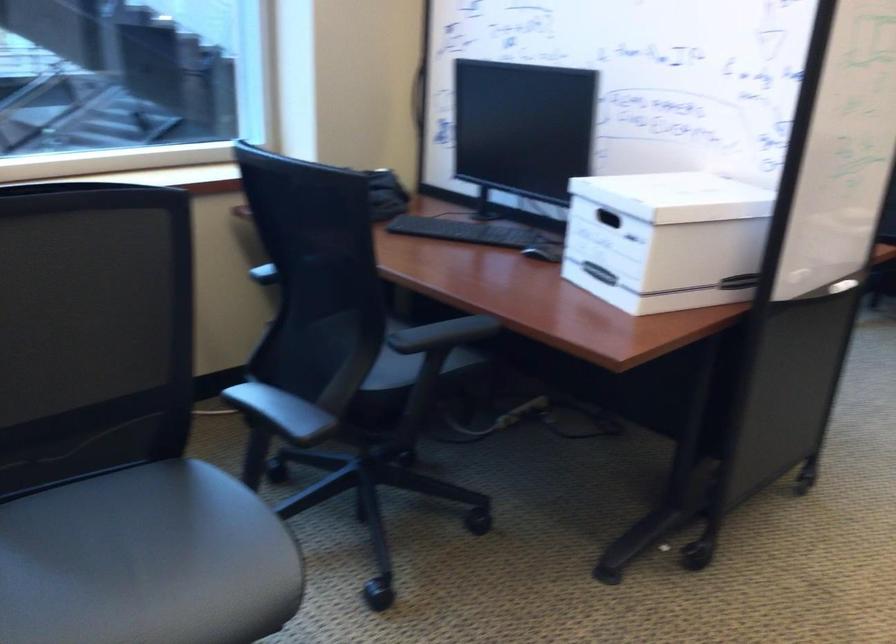
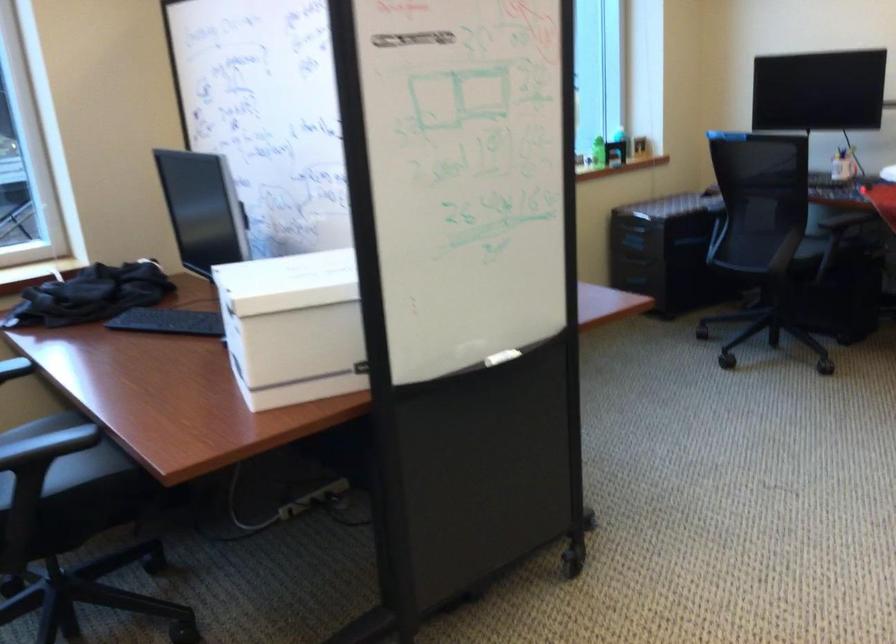
Where in the second image is the point corresponding to (x=462, y=336) from the first image?

(47, 446)